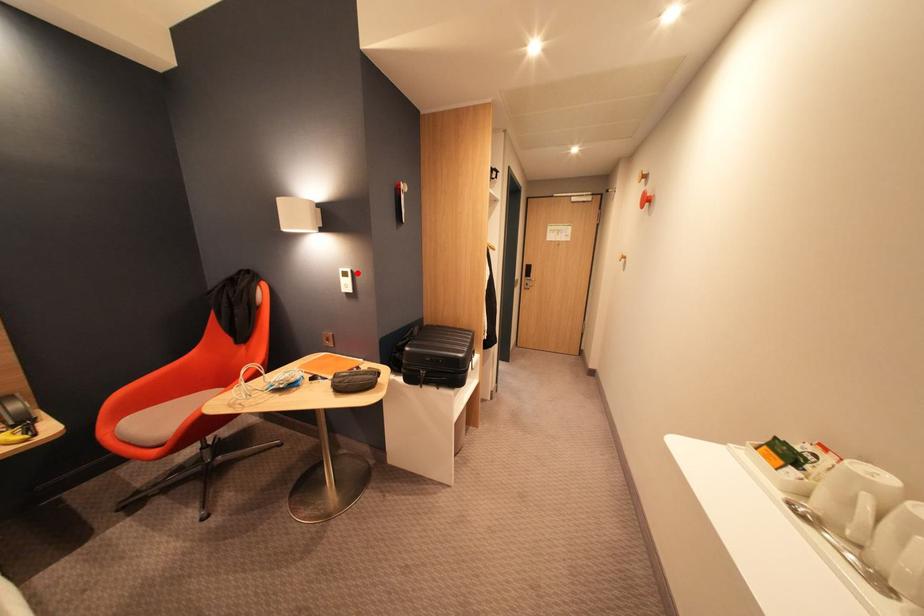
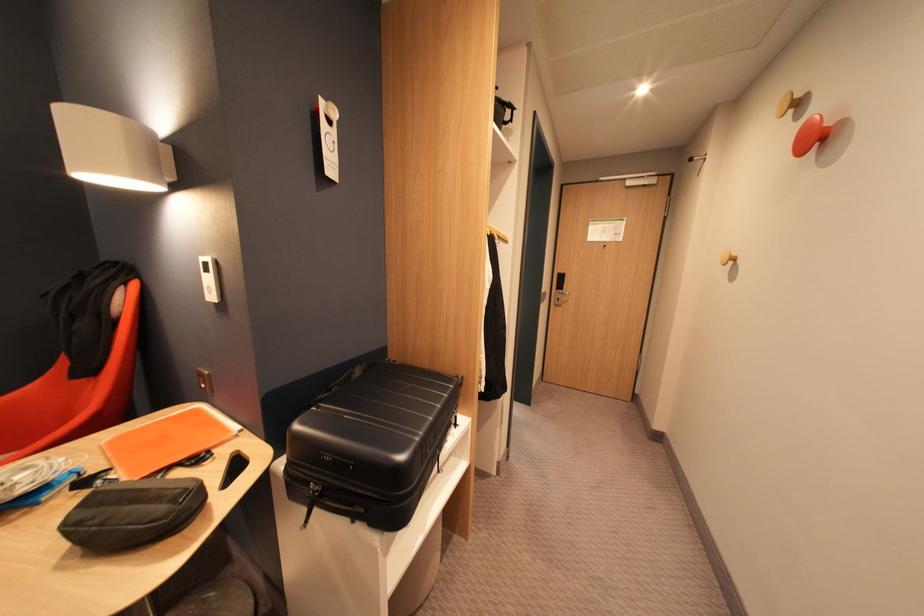
Where in the second image is the point corresponding to the highlighted location from the first image?

(216, 265)